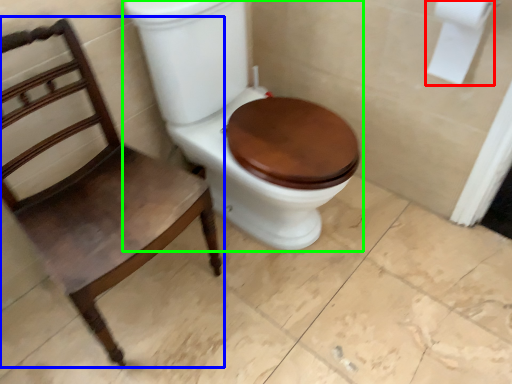
Question: Based on their relative distances, which object is farther from toilet paper (highlighted by a red box)? Choose from chair (highlighted by a blue box) and toilet (highlighted by a green box).

Choices:
 (A) chair
 (B) toilet

Answer: (A)